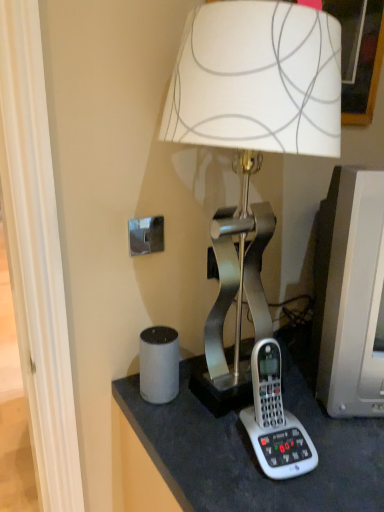
What do you see at coordinates (252, 120) in the screenshot? The image size is (384, 512). I see `metallic silver lamp at center` at bounding box center [252, 120].

In order to face matte gray monitor at right, should I rotate leftwards or rightwards?

Turn right approximately 23.173 degrees to face it.

This screenshot has height=512, width=384. Describe the element at coordinates (350, 294) in the screenshot. I see `matte gray monitor at right` at that location.

Measure the distance between white plastic corded phone at lower right and camera.

The distance of white plastic corded phone at lower right from camera is 28.94 inches.

The height and width of the screenshot is (512, 384). What are the coordinates of `metallic silver lamp at center` in the screenshot? It's located at coord(252,120).

The image size is (384, 512). What are the coordinates of `computer monitor behind the metallic silver lamp at center` in the screenshot? It's located at (350, 294).

From a real-world perspective, is matte gray monitor at right physically above metallic silver lamp at center?

Actually, matte gray monitor at right is physically below metallic silver lamp at center in the real world.

Is matte gray monitor at right taller than metallic silver lamp at center?

No.

From the image's perspective, between matte gray monitor at right and metallic silver lamp at center, who is located below?

matte gray monitor at right.

Can you confirm if matte gray monitor at right is thinner than white plastic corded phone at lower right?

No.

Is matte gray monitor at right positioned with its back to white plastic corded phone at lower right?

No, matte gray monitor at right is not facing away from white plastic corded phone at lower right.

Considering the sizes of matte gray monitor at right and white plastic corded phone at lower right in the image, is matte gray monitor at right taller or shorter than white plastic corded phone at lower right?

Considering their sizes, matte gray monitor at right has more height than white plastic corded phone at lower right.

Where is `corded phone below the matte gray monitor at right (from the image's perspective)`? corded phone below the matte gray monitor at right (from the image's perspective) is located at coordinates (275, 419).

Considering the relative sizes of white plastic corded phone at lower right and metallic silver lamp at center in the image provided, is white plastic corded phone at lower right wider than metallic silver lamp at center?

In fact, white plastic corded phone at lower right might be narrower than metallic silver lamp at center.

Is point (283, 456) in front of point (201, 84)?

No, it is behind (201, 84).

Considering the relative sizes of white plastic corded phone at lower right and metallic silver lamp at center in the image provided, is white plastic corded phone at lower right taller than metallic silver lamp at center?

No.

Is white plastic corded phone at lower right positioned with its back to metallic silver lamp at center?

Yes, white plastic corded phone at lower right's orientation is away from metallic silver lamp at center.

Is metallic silver lamp at center facing away from matte gray monitor at right?

No, matte gray monitor at right is not at the back of metallic silver lamp at center.

Is metallic silver lamp at center taller or shorter than matte gray monitor at right?

Considering their sizes, metallic silver lamp at center has more height than matte gray monitor at right.

Is metallic silver lamp at center wider or thinner than matte gray monitor at right?

Considering their sizes, metallic silver lamp at center looks broader than matte gray monitor at right.

Could you tell me if metallic silver lamp at center is facing white plastic corded phone at lower right?

Yes.

Can you confirm if metallic silver lamp at center is shorter than white plastic corded phone at lower right?

Incorrect, the height of metallic silver lamp at center does not fall short of that of white plastic corded phone at lower right.

Visually, is metallic silver lamp at center positioned to the left or to the right of white plastic corded phone at lower right?

metallic silver lamp at center is positioned on white plastic corded phone at lower right's left side.

Can you confirm if metallic silver lamp at center is bigger than white plastic corded phone at lower right?

Yes.

Is white plastic corded phone at lower right not inside matte gray monitor at right?

Absolutely, white plastic corded phone at lower right is external to matte gray monitor at right.

Is white plastic corded phone at lower right far from matte gray monitor at right?

That's not correct — white plastic corded phone at lower right is a little close to matte gray monitor at right.

Is white plastic corded phone at lower right aimed at matte gray monitor at right?

No, white plastic corded phone at lower right does not turn towards matte gray monitor at right.

The image size is (384, 512). Identify the location of lamp lying above the matte gray monitor at right (from the image's perspective). (252, 120).

This screenshot has height=512, width=384. In order to click on computer monitor on the right of white plastic corded phone at lower right in this screenshot , I will do `click(350, 294)`.

Which object lies further to the anchor point matte gray monitor at right, white plastic corded phone at lower right or metallic silver lamp at center?

metallic silver lamp at center lies further to matte gray monitor at right than the other object.

Considering their positions, is metallic silver lamp at center positioned further to matte gray monitor at right than white plastic corded phone at lower right?

Based on the image, metallic silver lamp at center appears to be further to matte gray monitor at right.

Looking at the image, which one is located further to white plastic corded phone at lower right, matte gray monitor at right or metallic silver lamp at center?

metallic silver lamp at center lies further to white plastic corded phone at lower right than the other object.

Which object lies nearer to the anchor point metallic silver lamp at center, white plastic corded phone at lower right or matte gray monitor at right?

matte gray monitor at right lies closer to metallic silver lamp at center than the other object.

Which object lies further to the anchor point white plastic corded phone at lower right, metallic silver lamp at center or matte gray monitor at right?

metallic silver lamp at center is further to white plastic corded phone at lower right.

Looking at this image, from the image, which object appears to be nearer to metallic silver lamp at center, matte gray monitor at right or white plastic corded phone at lower right?

Based on the image, matte gray monitor at right appears to be nearer to metallic silver lamp at center.

Locate an element on the screen. This screenshot has height=512, width=384. computer monitor that lies between metallic silver lamp at center and white plastic corded phone at lower right from top to bottom is located at coordinates (350, 294).